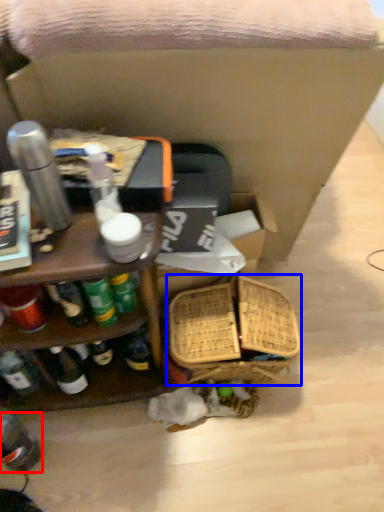
Question: Which of the following is the closest to the observer, bottle (highlighted by a red box) or basket (highlighted by a blue box)?

Choices:
 (A) bottle
 (B) basket

Answer: (A)